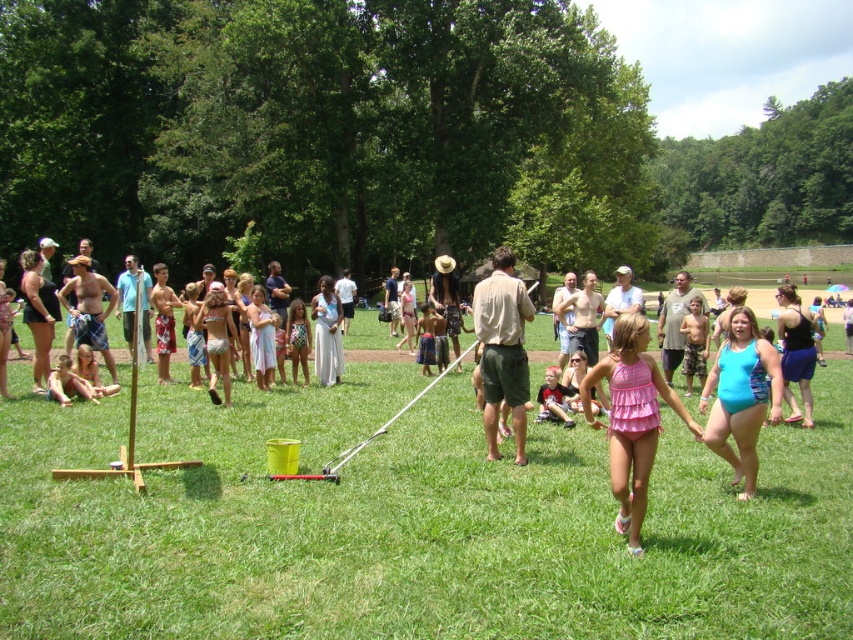
Question: Which point is closer to the camera?

Choices:
 (A) green grass at center
 (B) khaki cotton shirt at center
 (C) pink fabric swimsuit at center
 (D) blue swimsuit at center

Answer: (A)

Question: Which object appears closest to the camera in this image?

Choices:
 (A) blue swimsuit at center
 (B) pink fabric swimsuit at center
 (C) khaki cotton shirt at center

Answer: (B)

Question: Is blue swimsuit at center positioned behind khaki cotton shirt at center?

Choices:
 (A) yes
 (B) no

Answer: (B)

Question: Is green grass at center positioned before khaki cotton shirt at center?

Choices:
 (A) no
 (B) yes

Answer: (B)

Question: Which point is closer to the camera taking this photo?

Choices:
 (A) coord(502,298)
 (B) coord(625,356)

Answer: (B)

Question: Can you confirm if green grass at center is positioned to the right of pink fabric swimsuit at center?

Choices:
 (A) no
 (B) yes

Answer: (A)